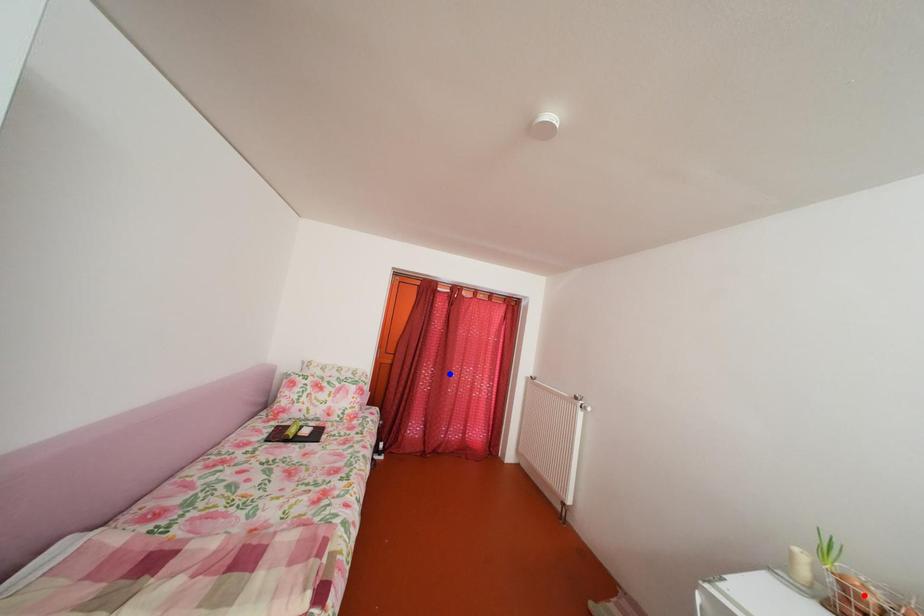
Question: Two points are marked on the image. Which point is closer to the camera?

Choices:
 (A) Blue point is closer.
 (B) Red point is closer.

Answer: (B)